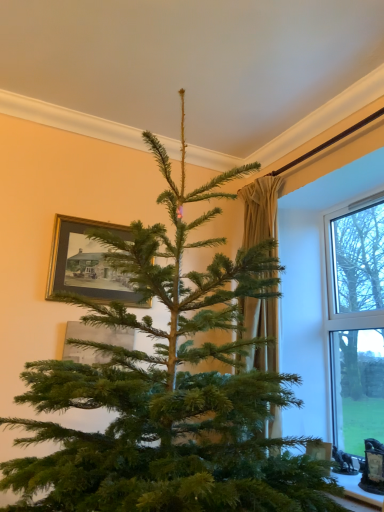
The image size is (384, 512). What are the coordinates of `gold-framed picture at upper left, placed as the second picture frame when sorted from top to bottom` in the screenshot? It's located at (94, 341).

The height and width of the screenshot is (512, 384). Describe the element at coordinates (94, 341) in the screenshot. I see `gold-framed picture at upper left, marked as the 1th picture frame in a bottom-to-top arrangement` at that location.

What is the approximate height of beige fabric curtain at center?

5.19 feet.

What do you see at coordinates (260, 210) in the screenshot?
I see `beige fabric curtain at center` at bounding box center [260, 210].

The width and height of the screenshot is (384, 512). Identify the location of white plastic window at right. (335, 304).

Can you tell me how much beige fabric curtain at center and gold-framed picture at upper left, the 2th picture frame from the bottom, differ in facing direction?

The angle between the facing direction of beige fabric curtain at center and the facing direction of gold-framed picture at upper left, the 2th picture frame from the bottom, is 86.6 degrees.

The width and height of the screenshot is (384, 512). Identify the location of curtain below the gold-framed picture at upper left, the 2th picture frame from the bottom (from the image's perspective). (260, 210).

Is beige fabric curtain at center aimed at gold-framed picture at upper left, the 2th picture frame from the bottom?

Yes, beige fabric curtain at center is facing gold-framed picture at upper left, the 2th picture frame from the bottom.

Does beige fabric curtain at center have a lesser width compared to gold-framed picture at upper left, positioned as the 1th picture frame in top-to-bottom order?

In fact, beige fabric curtain at center might be wider than gold-framed picture at upper left, positioned as the 1th picture frame in top-to-bottom order.

Is beige fabric curtain at center not near gold-framed picture at upper left, marked as the 1th picture frame in a bottom-to-top arrangement?

beige fabric curtain at center is near gold-framed picture at upper left, marked as the 1th picture frame in a bottom-to-top arrangement, not far away.

From a real-world perspective, between beige fabric curtain at center and gold-framed picture at upper left, placed as the second picture frame when sorted from top to bottom, who is vertically lower?

gold-framed picture at upper left, placed as the second picture frame when sorted from top to bottom.

Is beige fabric curtain at center facing away from gold-framed picture at upper left, marked as the 1th picture frame in a bottom-to-top arrangement?

That's not correct — beige fabric curtain at center is not looking away from gold-framed picture at upper left, marked as the 1th picture frame in a bottom-to-top arrangement.

From a real-world perspective, is gold-framed picture at upper left, the 2th picture frame from the bottom, under transparent glass window at right?

No, from a real-world perspective, gold-framed picture at upper left, the 2th picture frame from the bottom, is not beneath transparent glass window at right.

Locate an element on the screen. Image resolution: width=384 pixels, height=512 pixels. the 2nd picture frame to the left of the transparent glass window at right, counting from the anchor's position is located at coordinates (87, 263).

Is gold-framed picture at upper left, the 2th picture frame from the bottom, placed right next to transparent glass window at right?

No.

Considering the sizes of objects gold-framed picture at upper left, positioned as the 1th picture frame in top-to-bottom order, and transparent glass window at right in the image provided, who is wider, gold-framed picture at upper left, positioned as the 1th picture frame in top-to-bottom order, or transparent glass window at right?

Wider between the two is transparent glass window at right.

Between transparent glass window at right and gold-framed picture at upper left, marked as the 1th picture frame in a bottom-to-top arrangement, which one has larger size?

Bigger between the two is transparent glass window at right.

Considering the sizes of objects transparent glass window at right and gold-framed picture at upper left, placed as the second picture frame when sorted from top to bottom, in the image provided, who is wider, transparent glass window at right or gold-framed picture at upper left, placed as the second picture frame when sorted from top to bottom,?

Wider between the two is transparent glass window at right.

From a real-world perspective, is transparent glass window at right physically located above or below gold-framed picture at upper left, placed as the second picture frame when sorted from top to bottom?

transparent glass window at right is above gold-framed picture at upper left, placed as the second picture frame when sorted from top to bottom.

From the image's perspective, relative to white plastic window at right, is beige fabric curtain at center above or below?

Clearly, from the image's perspective, beige fabric curtain at center is above white plastic window at right.

Between point (275, 413) and point (338, 197), which one is positioned in front?

The point (275, 413) is closer to the camera.

From a real-world perspective, which object rests below the other?

In real-world perspective, white plastic window at right is lower.

Are gold-framed picture at upper left, positioned as the 1th picture frame in top-to-bottom order, and gold-framed picture at upper left, placed as the second picture frame when sorted from top to bottom, far apart?

gold-framed picture at upper left, positioned as the 1th picture frame in top-to-bottom order, is actually quite close to gold-framed picture at upper left, placed as the second picture frame when sorted from top to bottom.

From a real-world perspective, who is located higher, gold-framed picture at upper left, the 2th picture frame from the bottom, or gold-framed picture at upper left, marked as the 1th picture frame in a bottom-to-top arrangement?

From a 3D spatial view, gold-framed picture at upper left, the 2th picture frame from the bottom, is above.

Considering the relative sizes of gold-framed picture at upper left, the 2th picture frame from the bottom, and gold-framed picture at upper left, marked as the 1th picture frame in a bottom-to-top arrangement, in the image provided, is gold-framed picture at upper left, the 2th picture frame from the bottom, thinner than gold-framed picture at upper left, marked as the 1th picture frame in a bottom-to-top arrangement,?

No, gold-framed picture at upper left, the 2th picture frame from the bottom, is not thinner than gold-framed picture at upper left, marked as the 1th picture frame in a bottom-to-top arrangement.

Based on the photo, which is closer to the camera, (65, 351) or (257, 202)?

Clearly, point (65, 351) is closer to the camera than point (257, 202).

From a real-world perspective, is gold-framed picture at upper left, marked as the 1th picture frame in a bottom-to-top arrangement, under beige fabric curtain at center?

Indeed, from a real-world perspective, gold-framed picture at upper left, marked as the 1th picture frame in a bottom-to-top arrangement, is positioned beneath beige fabric curtain at center.

Where is `curtain on the right side of gold-framed picture at upper left, marked as the 1th picture frame in a bottom-to-top arrangement`? curtain on the right side of gold-framed picture at upper left, marked as the 1th picture frame in a bottom-to-top arrangement is located at coordinates (260, 210).

Is gold-framed picture at upper left, placed as the second picture frame when sorted from top to bottom, not close to beige fabric curtain at center?

Actually, gold-framed picture at upper left, placed as the second picture frame when sorted from top to bottom, and beige fabric curtain at center are a little close together.

I want to click on picture frame that is the 2nd one when counting leftward from the beige fabric curtain at center, so click(87, 263).

Where is `curtain that appears above the gold-framed picture at upper left, placed as the second picture frame when sorted from top to bottom (from the image's perspective)`? Image resolution: width=384 pixels, height=512 pixels. curtain that appears above the gold-framed picture at upper left, placed as the second picture frame when sorted from top to bottom (from the image's perspective) is located at coordinates (260, 210).

When comparing their distances from white plastic window at right, does transparent glass window at right or gold-framed picture at upper left, the 2th picture frame from the bottom, seem closer?

transparent glass window at right lies closer to white plastic window at right than the other object.

When comparing their distances from gold-framed picture at upper left, the 2th picture frame from the bottom, does transparent glass window at right or beige fabric curtain at center seem further?

Among the two, transparent glass window at right is located further to gold-framed picture at upper left, the 2th picture frame from the bottom.

Consider the image. Estimate the real-world distances between objects in this image. Which object is closer to gold-framed picture at upper left, placed as the second picture frame when sorted from top to bottom, white plastic window at right or beige fabric curtain at center?

Among the two, beige fabric curtain at center is located nearer to gold-framed picture at upper left, placed as the second picture frame when sorted from top to bottom.

Based on the photo, from the image, which object appears to be farther from transparent glass window at right, gold-framed picture at upper left, positioned as the 1th picture frame in top-to-bottom order, or white plastic window at right?

The object further to transparent glass window at right is gold-framed picture at upper left, positioned as the 1th picture frame in top-to-bottom order.

Considering their positions, is beige fabric curtain at center positioned closer to gold-framed picture at upper left, the 2th picture frame from the bottom, than transparent glass window at right?

beige fabric curtain at center is closer to gold-framed picture at upper left, the 2th picture frame from the bottom.

Which object lies nearer to the anchor point transparent glass window at right, white plastic window at right or beige fabric curtain at center?

Based on the image, white plastic window at right appears to be nearer to transparent glass window at right.

When comparing their distances from gold-framed picture at upper left, placed as the second picture frame when sorted from top to bottom, does beige fabric curtain at center or transparent glass window at right seem closer?

beige fabric curtain at center is positioned closer to the anchor gold-framed picture at upper left, placed as the second picture frame when sorted from top to bottom.

Based on their spatial positions, is beige fabric curtain at center or gold-framed picture at upper left, positioned as the 1th picture frame in top-to-bottom order, further from transparent glass window at right?

gold-framed picture at upper left, positioned as the 1th picture frame in top-to-bottom order, is further to transparent glass window at right.

Image resolution: width=384 pixels, height=512 pixels. I want to click on picture frame between gold-framed picture at upper left, the 2th picture frame from the bottom, and beige fabric curtain at center, so click(94, 341).

The image size is (384, 512). Identify the location of curtain situated between gold-framed picture at upper left, positioned as the 1th picture frame in top-to-bottom order, and white plastic window at right from left to right. (260, 210).

This screenshot has width=384, height=512. Identify the location of curtain situated between gold-framed picture at upper left, marked as the 1th picture frame in a bottom-to-top arrangement, and white plastic window at right from left to right. [x=260, y=210].

You are a GUI agent. You are given a task and a screenshot of the screen. Output one action in this format:
    pyautogui.click(x=<x>, y=<y>)
    Task: Click on the window located between gold-framed picture at upper left, positioned as the 1th picture frame in top-to-bottom order, and white plastic window at right in the left-right direction
    
    Given the screenshot: What is the action you would take?
    pyautogui.click(x=356, y=322)